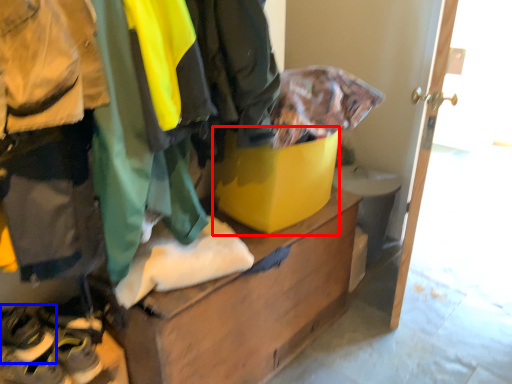
Question: Which point is further to the camera, cardboard box (highlighted by a red box) or footwear (highlighted by a blue box)?

Choices:
 (A) cardboard box
 (B) footwear

Answer: (A)